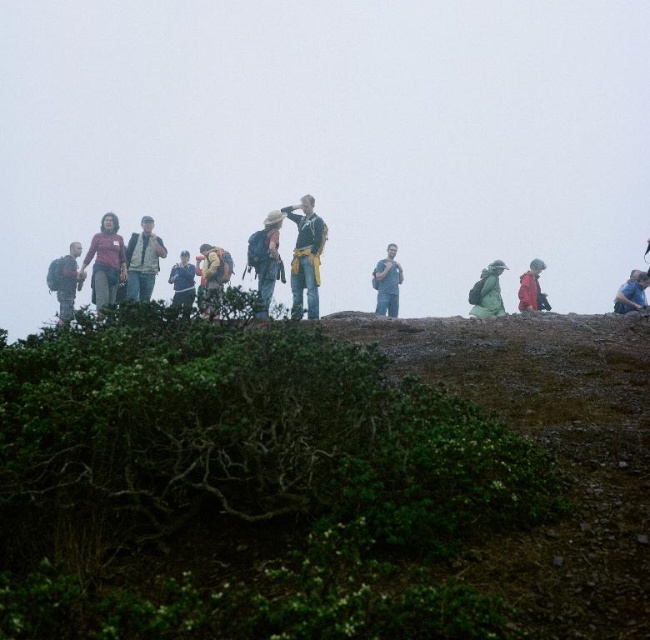
Question: Which of the following is the farthest from the observer?

Choices:
 (A) (144, 236)
 (B) (499, 280)

Answer: (B)

Question: Which point is farther to the camera?

Choices:
 (A) (374, 273)
 (B) (174, 276)
 (C) (500, 268)

Answer: (A)

Question: Can you confirm if matte black jacket at center is thinner than camouflage backpack at center?

Choices:
 (A) no
 (B) yes

Answer: (B)

Question: Is blue jeans at center to the right of dark blue jacket at center from the viewer's perspective?

Choices:
 (A) yes
 (B) no

Answer: (A)

Question: Considering the relative positions of matte yellow backpack at center and blue jeans at center in the image provided, where is matte yellow backpack at center located with respect to blue jeans at center?

Choices:
 (A) above
 (B) below

Answer: (A)

Question: Among these points, which one is farthest from the camera?

Choices:
 (A) (140, 294)
 (B) (540, 272)

Answer: (B)